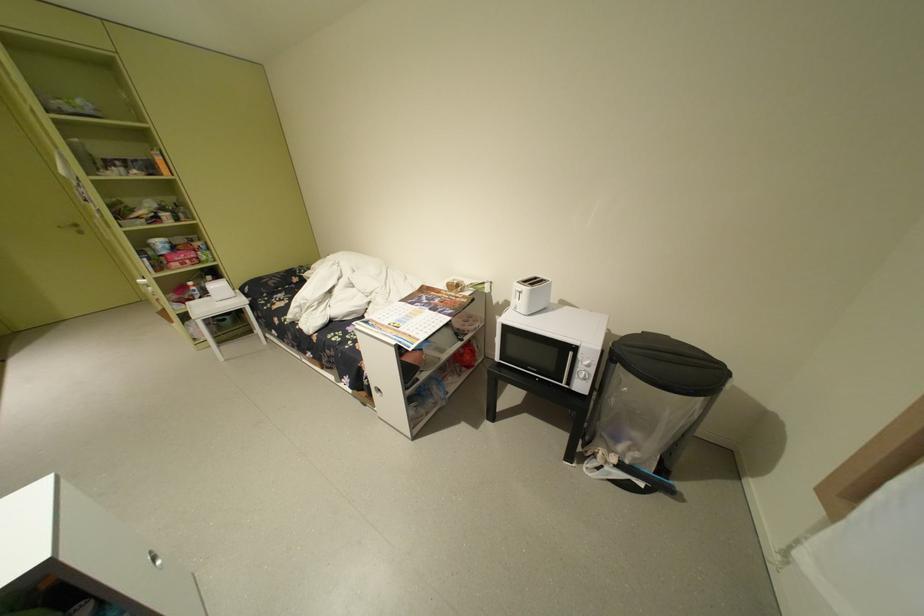
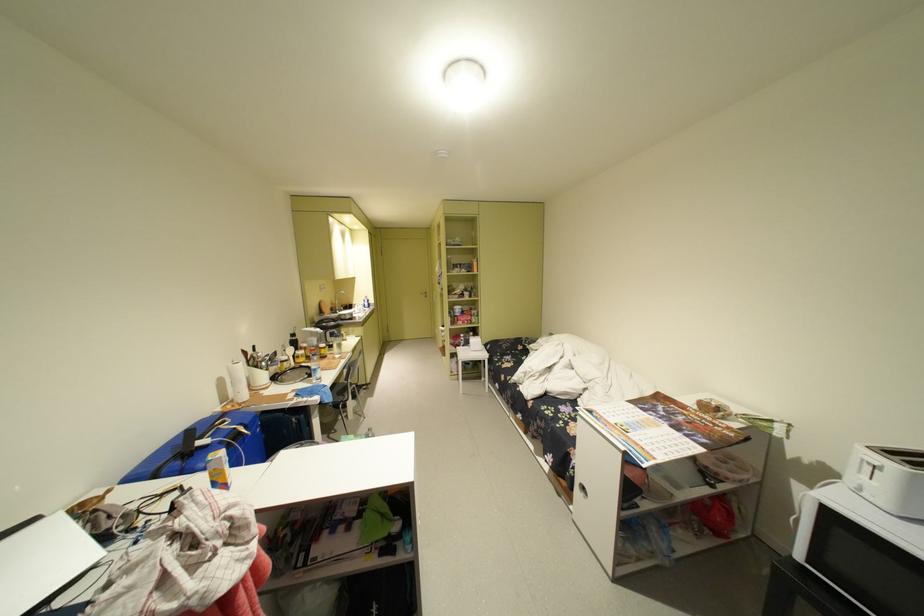
Locate, in the second image, the point that corresponds to the point at 382,395 in the first image.

(582, 488)